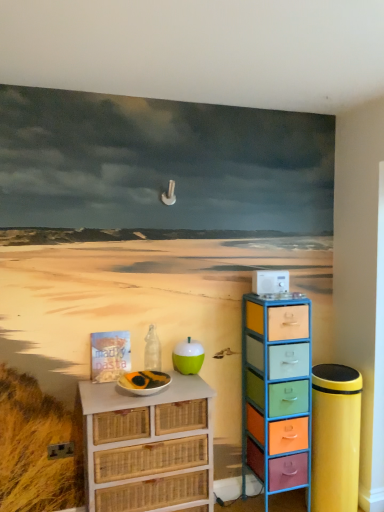
Find the location of a particular element. The height and width of the screenshot is (512, 384). free space above white wicker chest of drawers at lower left, the second chest of drawers from the right (from a real-world perspective) is located at coordinates 156,379.